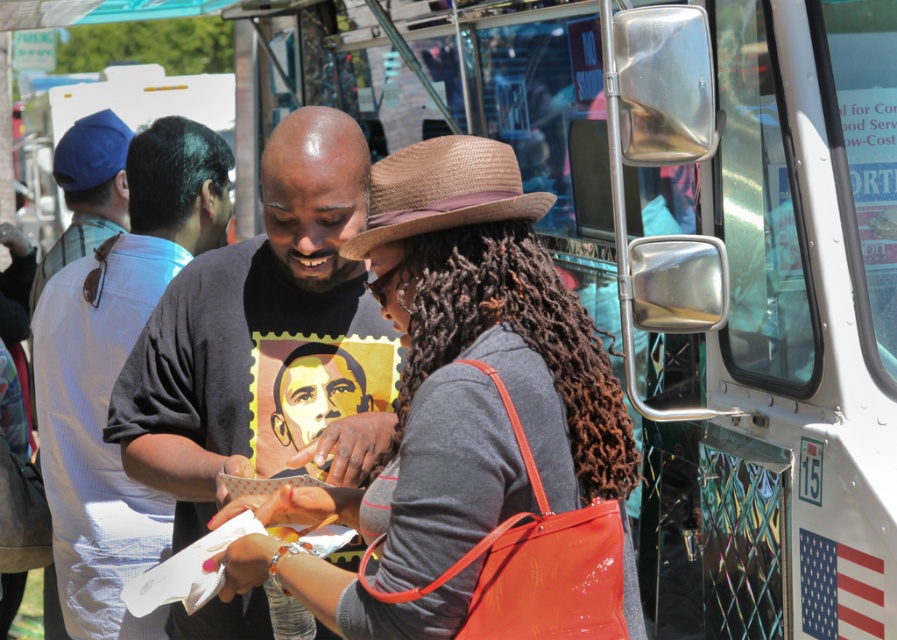
Which is in front, point (468, 490) or point (135, 496)?

Point (468, 490)

In the scene shown: Does matte gray shirt at center have a smaller size compared to white striped shirt at left?

Yes.

Find the location of `matte gray shirt at center`. matte gray shirt at center is located at coordinates (475, 369).

Who is more forward, (274, 570) or (540, 244)?

Point (274, 570) is in front.

Does matte gray shirt at center have a lesser height compared to brown curly hair at center?

No, matte gray shirt at center is not shorter than brown curly hair at center.

Who is more distant from viewer, (466, 150) or (582, 332)?

Positioned behind is point (582, 332).

Find the location of a particular element. The width and height of the screenshot is (897, 640). matte gray shirt at center is located at coordinates (475, 369).

Consider the image. Between matte black t-shirt at center and brown curly hair at center, which one appears on the left side from the viewer's perspective?

From the viewer's perspective, matte black t-shirt at center appears more on the left side.

Can you confirm if matte black t-shirt at center is positioned above brown curly hair at center?

Yes, matte black t-shirt at center is above brown curly hair at center.

In order to click on matte black t-shirt at center in this screenshot , I will do (x=255, y=332).

Identify the location of matte black t-shirt at center. (255, 332).